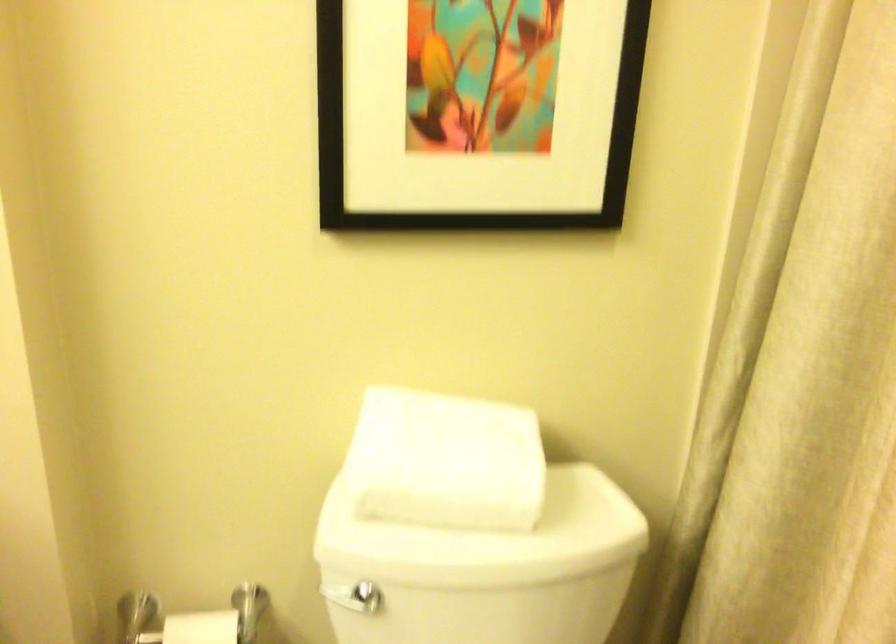
This screenshot has width=896, height=644. What are the coordinates of `silver toilet handle` in the screenshot? It's located at (359, 598).